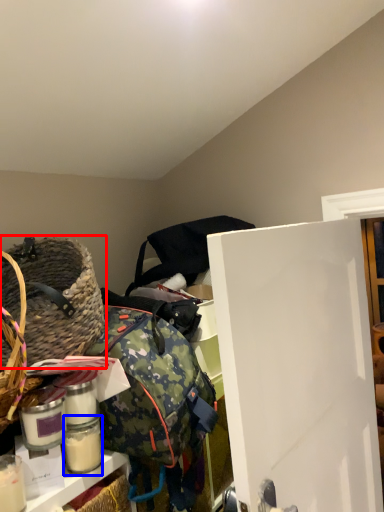
Question: Which object appears farthest to the camera in this image, picnic basket (highlighted by a red box) or glass jar (highlighted by a blue box)?

Choices:
 (A) picnic basket
 (B) glass jar

Answer: (B)